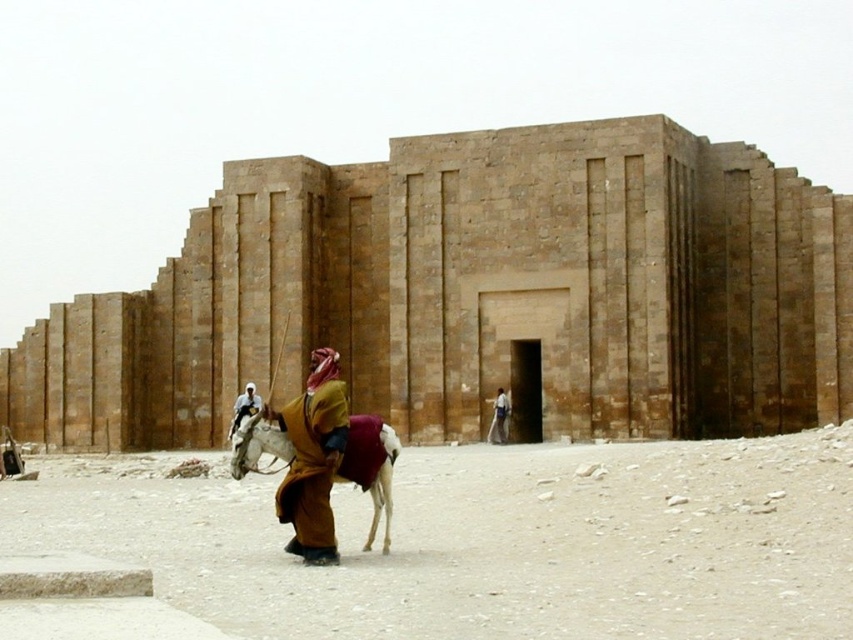
Where is the brown woolen robe at center located in the image?

The brown woolen robe at center is located at point (312, 458) in the image.

You are an archaeologist examining the two items in the desert scene. Which item is taller between the brown woolen robe at center and the light brown leather jacket at center?

The brown woolen robe at center is taller than the light brown leather jacket at center.